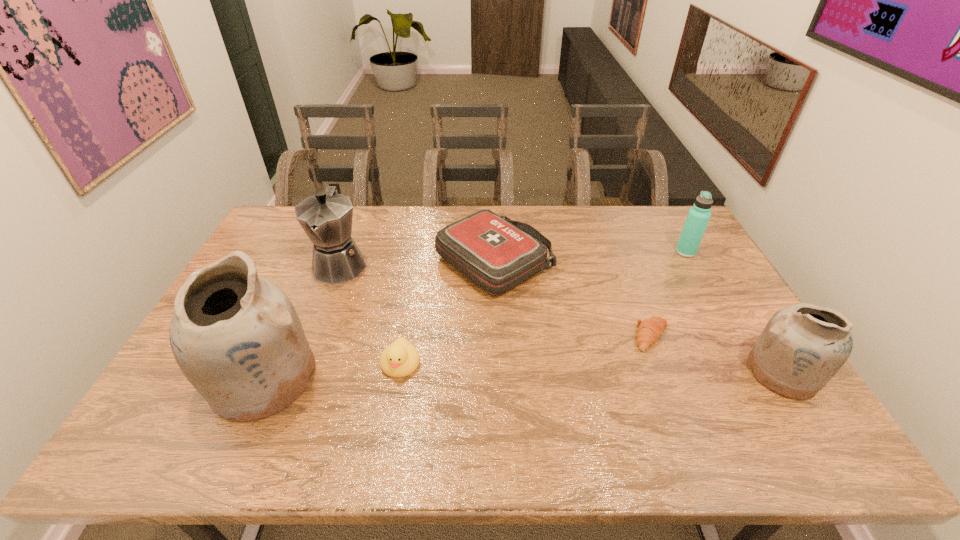
Identify which object is located as the nearest to the left pottery. Please provide its 2D coordinates. Your answer should be formatted as a tuple, i.e. [(x, y)], where the tuple contains the x and y coordinates of a point satisfying the conditions above.

[(400, 359)]

I want to click on free region that satisfies the following two spatial constraints: 1. at the spout of the shorter pottery; 2. on the left side of the coffeepot, so click(300, 372).

Locate an element on the screen. The width and height of the screenshot is (960, 540). free space that satisfies the following two spatial constraints: 1. on the front side of the right pottery; 2. on the right side of the thermos bottle is located at coordinates (755, 372).